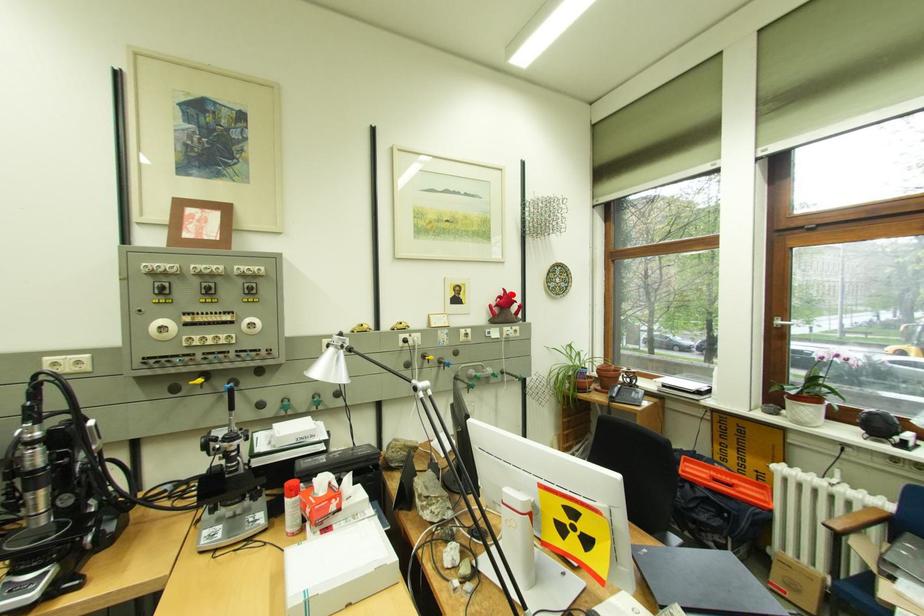
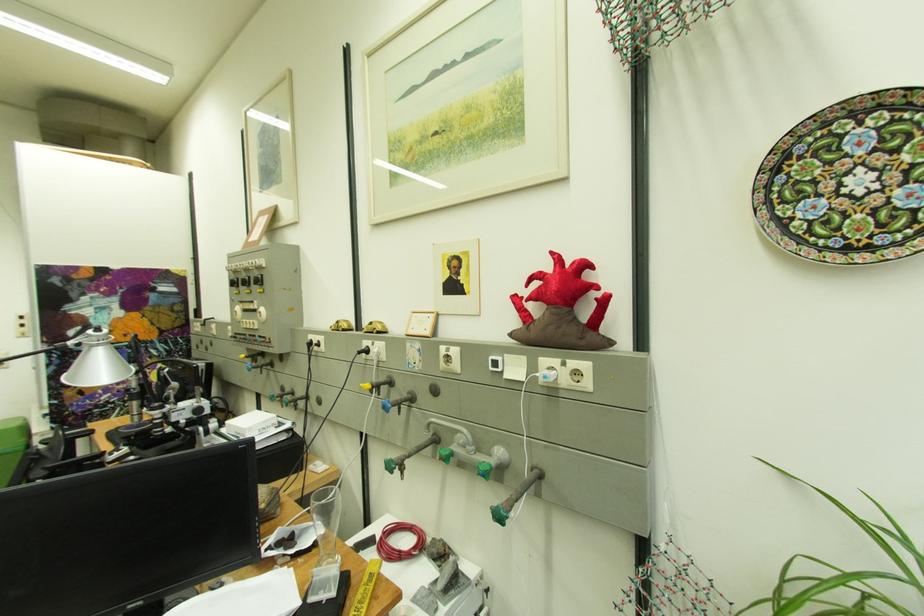
The point at the highlighted location is marked in the first image. Where is the corresponding point in the second image?

(560, 267)